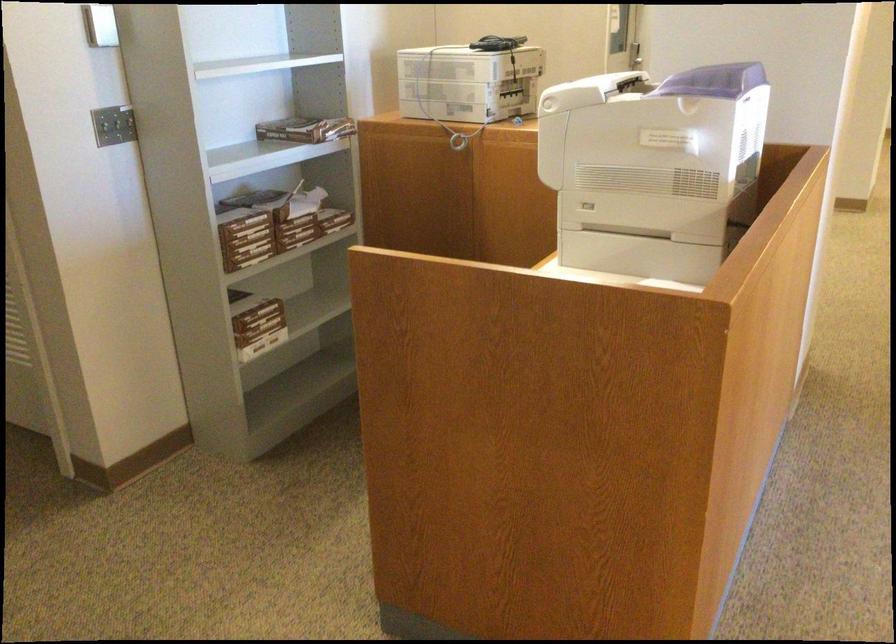
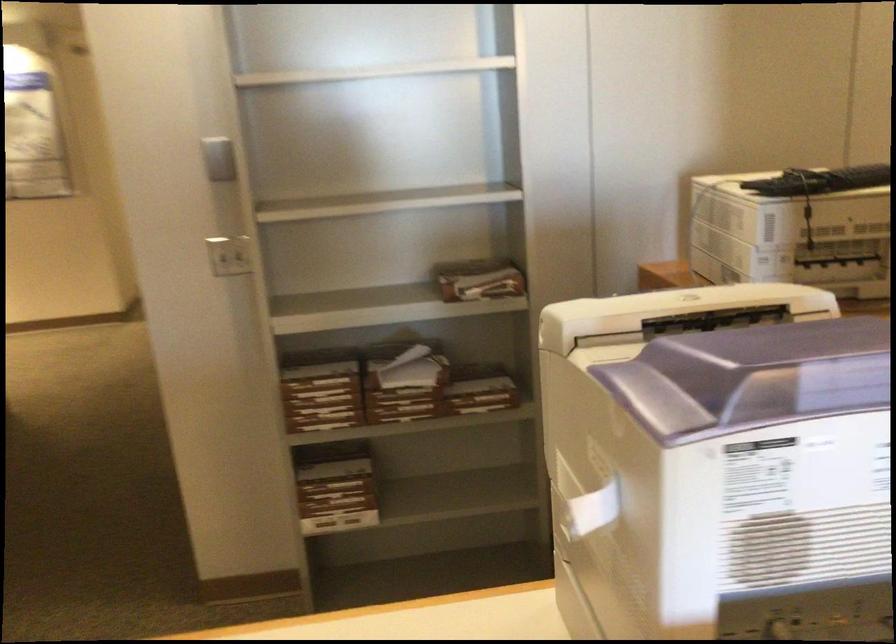
Find the pixel in the second image that matches the point at 667,122 in the first image.

(592, 507)